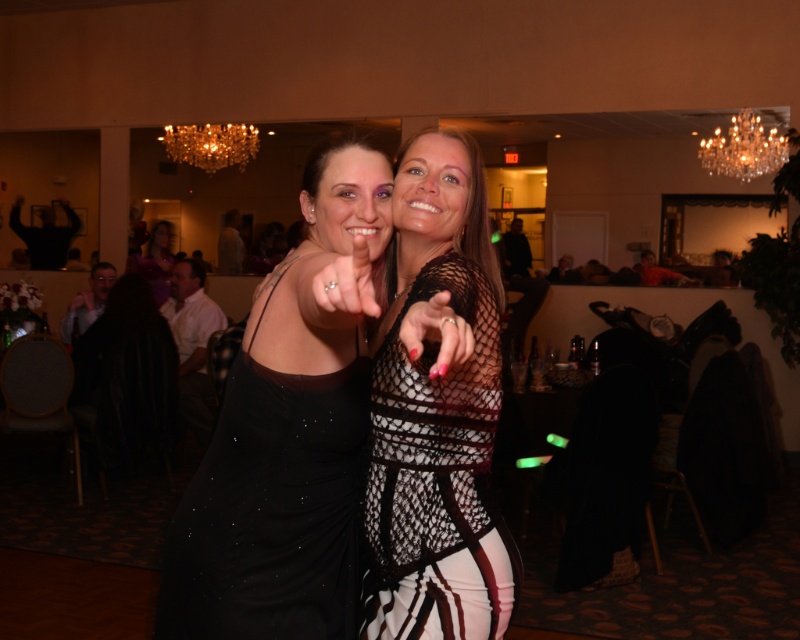
What do you see at coordinates (350, 282) in the screenshot? I see `matte black ring at center` at bounding box center [350, 282].

Where is `matte black ring at center`? matte black ring at center is located at coordinates (350, 282).

Is point (458, 148) farther from viewer compared to point (762, 148)?

No.

Which is below, black mesh dress at center or crystal glass chandelier at upper center?

black mesh dress at center

Who is more distant from viewer, (444,452) or (750,148)?

Point (750,148)

Where is `black mesh dress at center`? This screenshot has width=800, height=640. black mesh dress at center is located at coordinates (436, 413).

Between black sequined dress at center and matte purple dress at center, which one appears on the right side from the viewer's perspective?

black sequined dress at center

Which is above, black sequined dress at center or matte purple dress at center?

Positioned higher is matte purple dress at center.

I want to click on black sequined dress at center, so click(x=272, y=509).